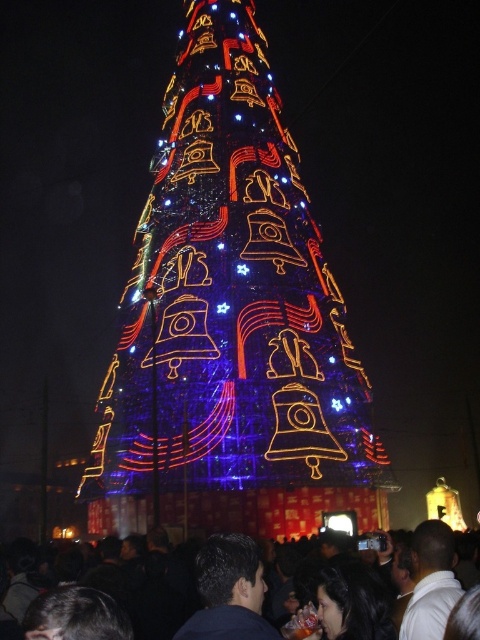
Question: Can you confirm if illuminated glass christmas tree at center is positioned below dark blue fabric at center?

Choices:
 (A) no
 (B) yes

Answer: (A)

Question: Which point is closer to the camera?

Choices:
 (A) (227, 112)
 (B) (212, 538)

Answer: (B)

Question: Is illuminated glass christmas tree at center thinner than black matte crowd at lower center?

Choices:
 (A) yes
 (B) no

Answer: (A)

Question: Does illuminated glass christmas tree at center appear on the right side of black matte crowd at lower center?

Choices:
 (A) no
 (B) yes

Answer: (A)

Question: Which is farther from the illuminated glass christmas tree at center?

Choices:
 (A) black matte crowd at lower center
 (B) dark blue fabric at center

Answer: (B)

Question: Among these points, which one is nearest to the camera?

Choices:
 (A) click(x=196, y=292)
 (B) click(x=203, y=561)
 (C) click(x=183, y=579)

Answer: (B)